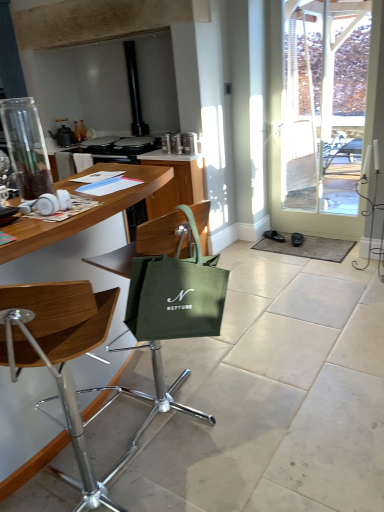
Identify the location of vacant area located to the right-hand side of black leather shoe at lower right, the 2th footwear from the left. This screenshot has width=384, height=512. (316, 242).